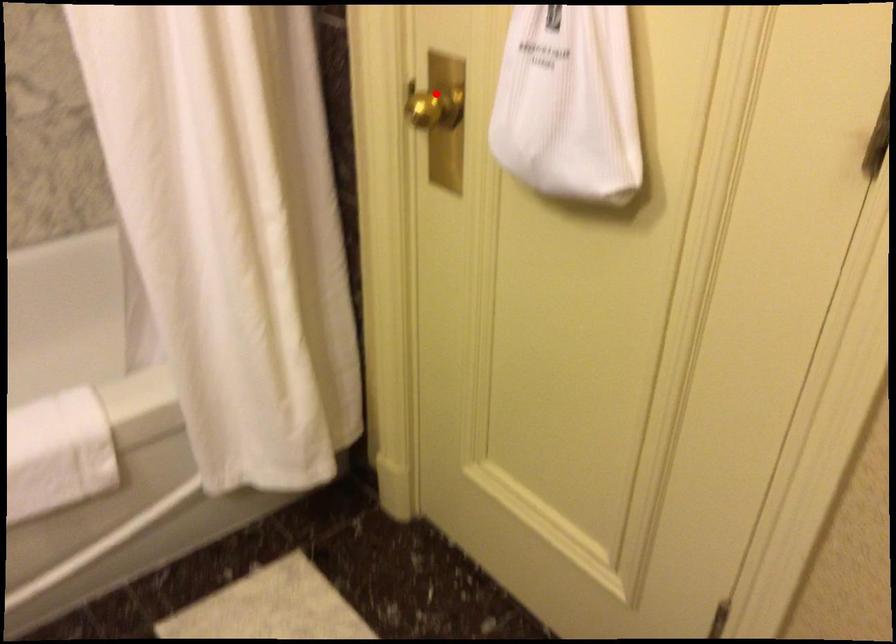
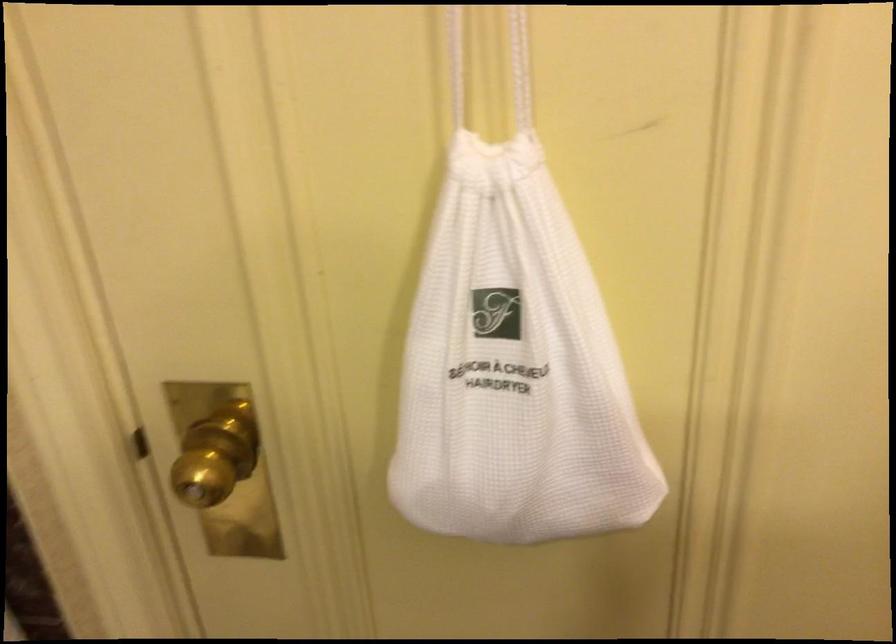
Question: I am providing you with two images of the same scene from different viewpoints. A red point is shown in image1. For the corresponding object point in image2, is it positioned nearer or farther from the camera?

Choices:
 (A) Nearer
 (B) Farther

Answer: (A)